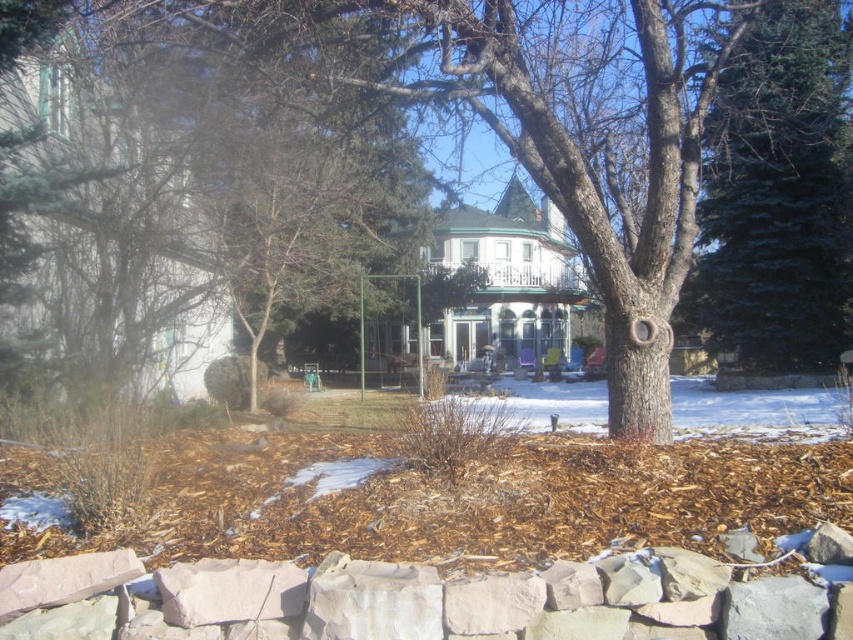
You are planning to place a new garden bench in the winter scene. The bench requires a space larger than the green fir tree at right. Can the area near the brown bark tree at center accommodate it?

The brown bark tree at center has a larger size compared to the green fir tree at right, so the area near the brown bark tree at center can accommodate the bench since it has more space available.

You are standing in the garden area of the winter scene. You see the brown bark tree at center and the green fir tree at right. Which tree is closer to you?

The brown bark tree at center is closer to you because it is in front of the green fir tree at right.

You are standing in the winter scene and want to walk from the point at coordinate (643, 150) to the point at (722, 272). Which direction should you move to get closer to your destination?

You should move away from the viewer because the point at (722, 272) is further away than the point at (643, 150).